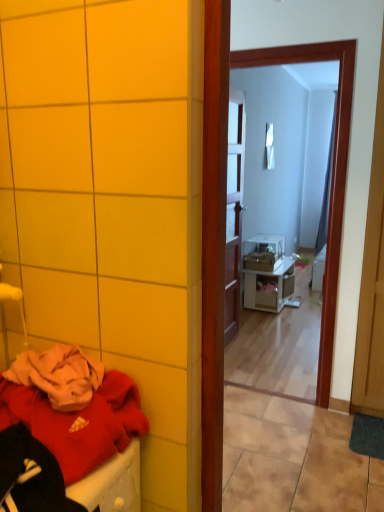
Question: Should I look upward or downward to see wooden door at center?

Choices:
 (A) down
 (B) up

Answer: (B)

Question: From the image's perspective, would you say wooden door at center is shown under white glossy nightstand at center?

Choices:
 (A) no
 (B) yes

Answer: (A)

Question: Is wooden door at center thinner than white glossy nightstand at center?

Choices:
 (A) no
 (B) yes

Answer: (B)

Question: Is wooden door at center in front of white glossy nightstand at center?

Choices:
 (A) yes
 (B) no

Answer: (A)

Question: Can you confirm if wooden door at center is positioned to the left of white glossy nightstand at center?

Choices:
 (A) yes
 (B) no

Answer: (A)

Question: Does wooden door at center have a greater width compared to white glossy nightstand at center?

Choices:
 (A) no
 (B) yes

Answer: (A)

Question: Is wooden door at center completely or partially outside of white glossy nightstand at center?

Choices:
 (A) no
 (B) yes

Answer: (B)

Question: Does white glossy nightstand at center have a greater width compared to wooden door at center?

Choices:
 (A) yes
 (B) no

Answer: (A)

Question: Is white glossy nightstand at center at the right side of wooden door at center?

Choices:
 (A) no
 (B) yes

Answer: (B)

Question: Is white glossy nightstand at center next to wooden door at center and touching it?

Choices:
 (A) no
 (B) yes

Answer: (A)

Question: From a real-world perspective, is white glossy nightstand at center on top of wooden door at center?

Choices:
 (A) yes
 (B) no

Answer: (B)

Question: Are white glossy nightstand at center and wooden door at center located far from each other?

Choices:
 (A) yes
 (B) no

Answer: (B)

Question: Is white glossy nightstand at center not inside wooden door at center?

Choices:
 (A) no
 (B) yes

Answer: (B)

Question: From a real-world perspective, is white glossy nightstand at center positioned over matte red sweater at lower left based on gravity?

Choices:
 (A) yes
 (B) no

Answer: (B)